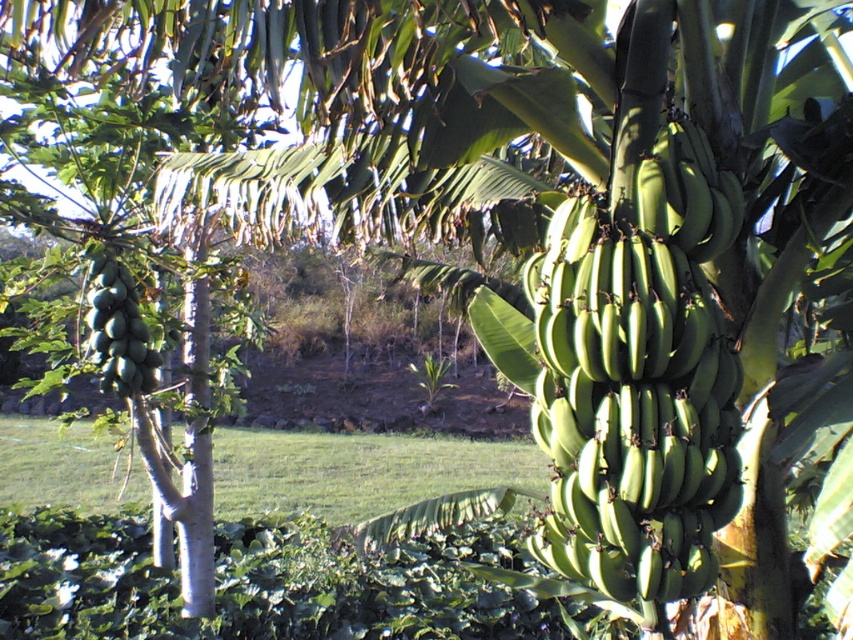
Question: Which object appears closest to the camera in this image?

Choices:
 (A) green matte papaya at left
 (B) green matte bananas at center

Answer: (B)

Question: Can you confirm if green matte bananas at center is positioned to the left of green matte papaya at left?

Choices:
 (A) yes
 (B) no

Answer: (B)

Question: Among these points, which one is nearest to the camera?

Choices:
 (A) (113, 353)
 (B) (672, 355)

Answer: (B)

Question: Is green matte bananas at center positioned before green matte papaya at left?

Choices:
 (A) no
 (B) yes

Answer: (B)

Question: Does green matte bananas at center appear on the right side of green matte papaya at left?

Choices:
 (A) no
 (B) yes

Answer: (B)